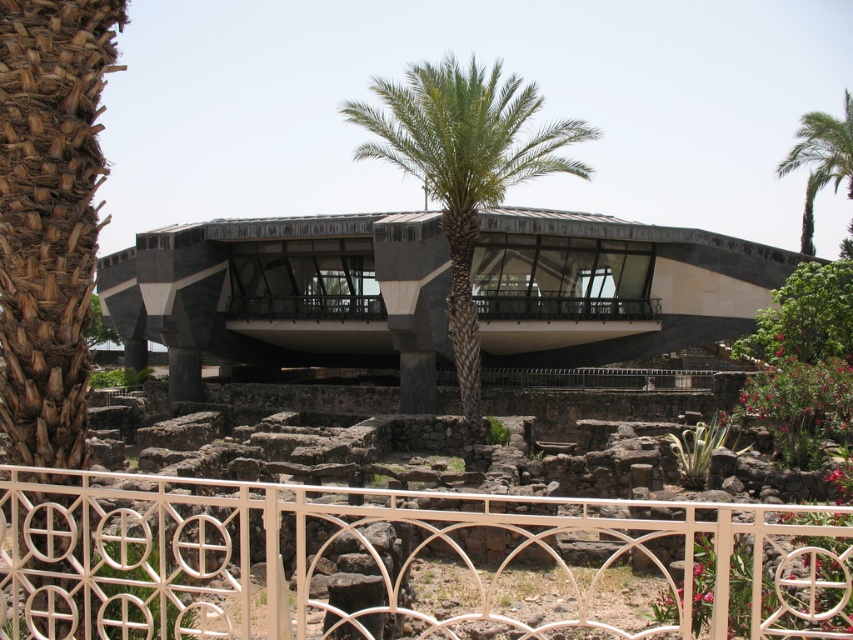
Question: Which point appears closest to the camera in this image?

Choices:
 (A) (508, 179)
 (B) (839, 269)

Answer: (A)

Question: Which object appears closest to the camera in this image?

Choices:
 (A) white metal fence at lower center
 (B) green leafy tree at upper right

Answer: (A)

Question: Among these objects, which one is farthest from the camera?

Choices:
 (A) green leafy palm tree at upper right
 (B) green leafy palm tree at center
 (C) green leafy tree at upper right

Answer: (A)

Question: Does green leafy tree at upper right have a lesser width compared to green leafy palm tree at upper right?

Choices:
 (A) no
 (B) yes

Answer: (B)

Question: Is white metal fence at lower center further to the viewer compared to green leafy palm tree at upper right?

Choices:
 (A) no
 (B) yes

Answer: (A)

Question: In this image, where is white metal fence at lower center located relative to green leafy palm tree at center?

Choices:
 (A) below
 (B) above

Answer: (A)